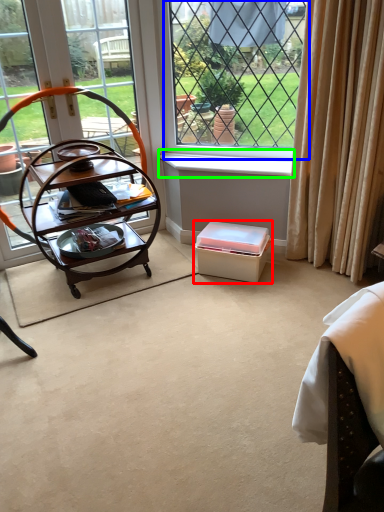
Question: Which is farther away from box (highlighted by a red box)? window (highlighted by a blue box) or window sill (highlighted by a green box)?

Choices:
 (A) window
 (B) window sill

Answer: (A)